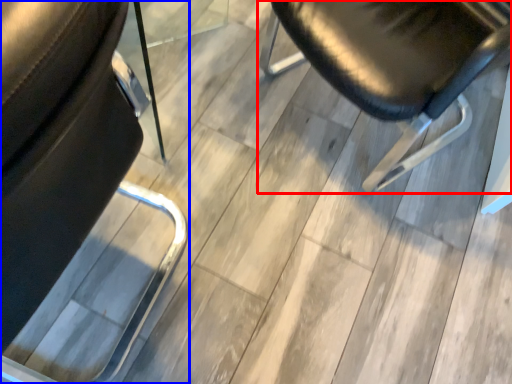
Question: Which point is further to the camera, chair (highlighted by a red box) or chair (highlighted by a blue box)?

Choices:
 (A) chair
 (B) chair

Answer: (A)